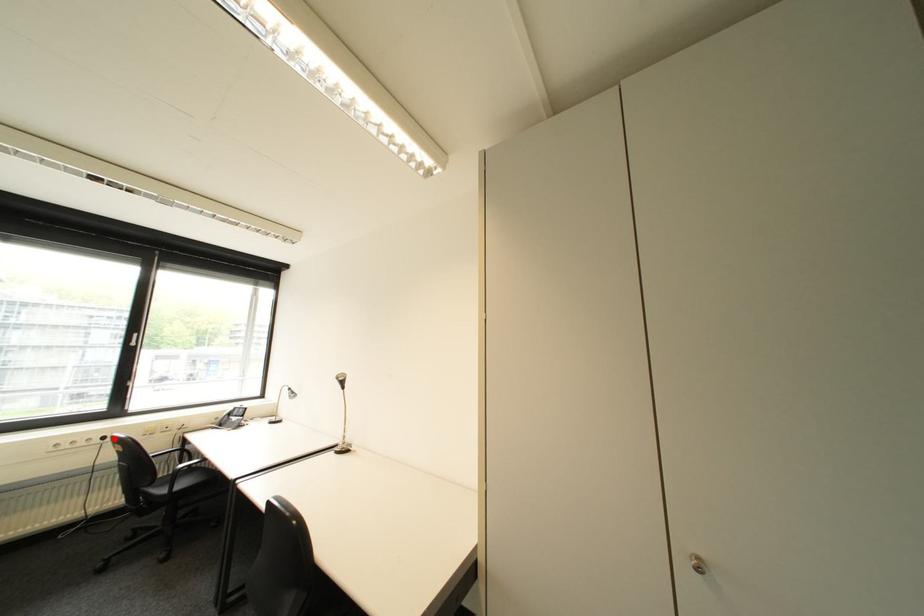
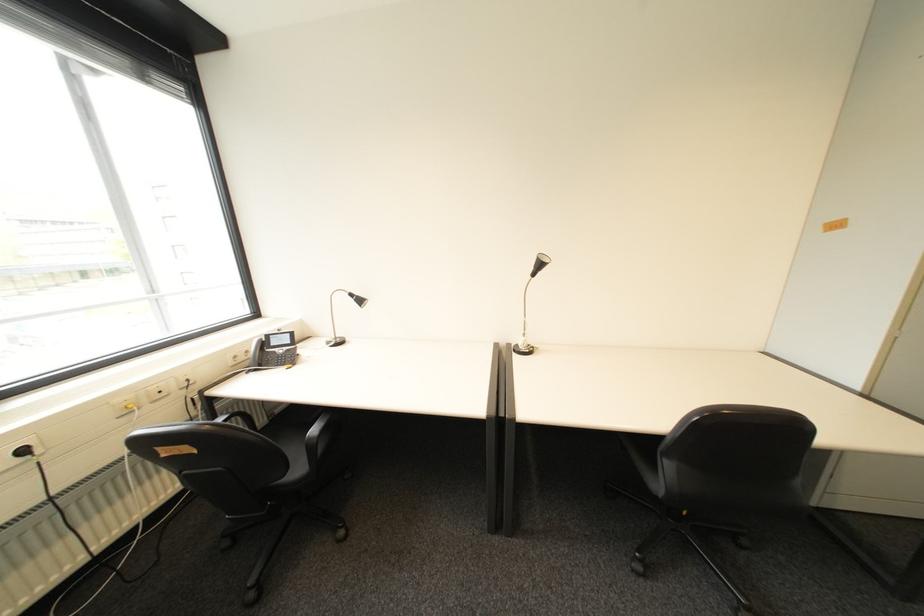
The point at the highlighted location is marked in the first image. Where is the corresponding point in the second image?

(34, 452)